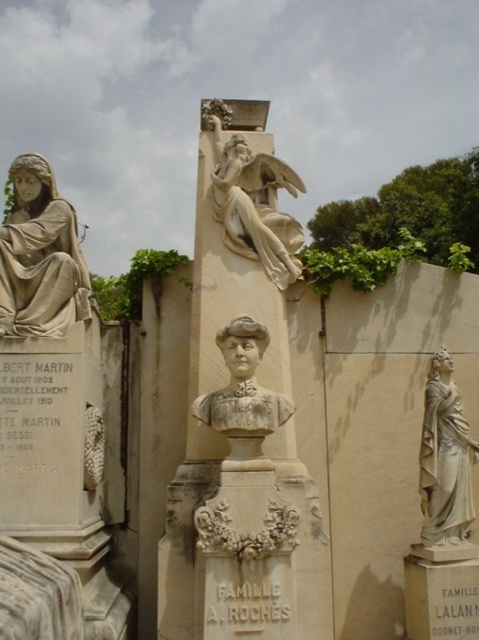
Between point (229, 528) and point (432, 412), which one is positioned in front?

Positioned in front is point (229, 528).

Locate an element on the screen. This screenshot has height=640, width=479. white stone column at center is located at coordinates (241, 412).

Find the location of a particular element. The width and height of the screenshot is (479, 640). white stone column at center is located at coordinates (241, 412).

Who is positioned more to the left, matte stone statue at left or matte stone bust at center?

From the viewer's perspective, matte stone statue at left appears more on the left side.

Is point (49, 212) closer to camera compared to point (243, 385)?

No, (49, 212) is further to viewer.

Is point (59, 288) positioned in front of point (241, 365)?

That is False.

Where is `matte stone statue at left`? The width and height of the screenshot is (479, 640). matte stone statue at left is located at coordinates (40, 257).

Consider the image. Is matte stone statue at left further to the viewer compared to white marble statue at center?

No, it is not.

Which is in front, point (47, 266) or point (205, 116)?

Point (47, 266) is in front.

Find the location of a particular element. matte stone statue at left is located at coordinates (40, 257).